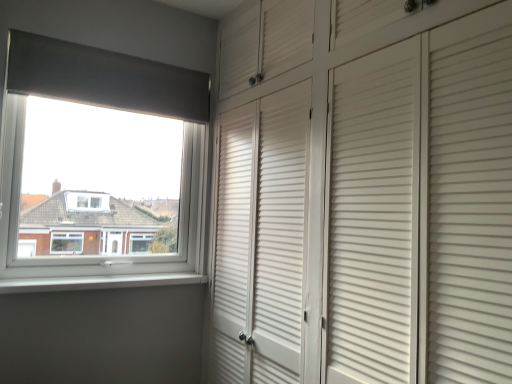
Question: Can you confirm if white plastic window at upper left is thinner than white smooth window sill at lower left?

Choices:
 (A) yes
 (B) no

Answer: (B)

Question: Can you confirm if white plastic window at upper left is positioned to the left of white smooth window sill at lower left?

Choices:
 (A) yes
 (B) no

Answer: (A)

Question: From a real-world perspective, is white plastic window at upper left on white smooth window sill at lower left?

Choices:
 (A) no
 (B) yes

Answer: (B)

Question: Could you tell me if white plastic window at upper left is turned towards white smooth window sill at lower left?

Choices:
 (A) yes
 (B) no

Answer: (B)

Question: Does white plastic window at upper left have a smaller size compared to white smooth window sill at lower left?

Choices:
 (A) no
 (B) yes

Answer: (A)

Question: From a real-world perspective, is white plastic window at upper left physically below white smooth window sill at lower left?

Choices:
 (A) yes
 (B) no

Answer: (B)

Question: Is white plastic window at upper left located within white smooth window sill at lower left?

Choices:
 (A) no
 (B) yes

Answer: (A)

Question: Is white smooth window sill at lower left further to the viewer compared to white plastic window at upper left?

Choices:
 (A) yes
 (B) no

Answer: (B)

Question: Is white smooth window sill at lower left positioned far away from white plastic window at upper left?

Choices:
 (A) no
 (B) yes

Answer: (A)

Question: From the image's perspective, is white smooth window sill at lower left under white plastic window at upper left?

Choices:
 (A) yes
 (B) no

Answer: (A)

Question: Can we say white smooth window sill at lower left lies outside white plastic window at upper left?

Choices:
 (A) no
 (B) yes

Answer: (B)

Question: Does white smooth window sill at lower left touch white plastic window at upper left?

Choices:
 (A) yes
 (B) no

Answer: (B)

Question: From a real-world perspective, is white smooth window sill at lower left above or below white plastic window at upper left?

Choices:
 (A) below
 (B) above

Answer: (A)